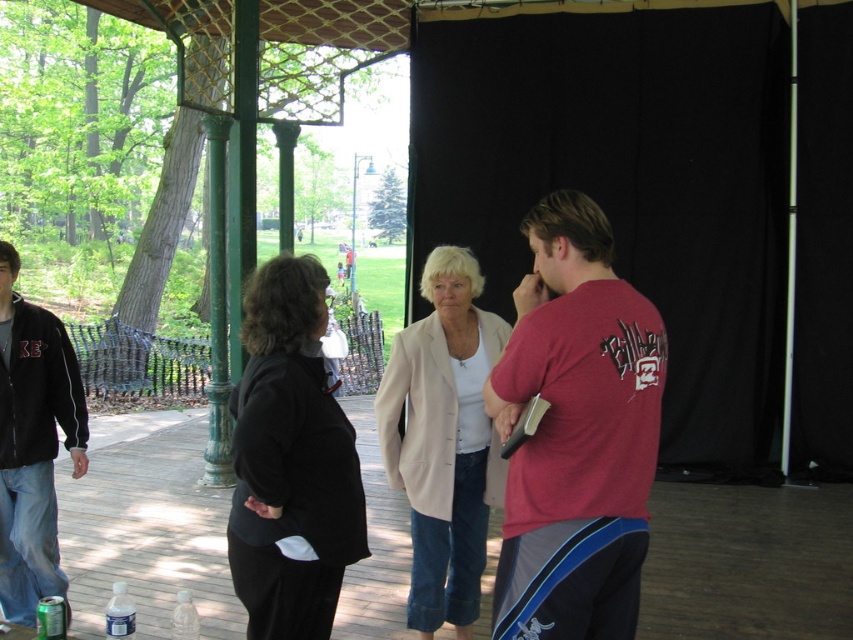
Question: Which of the following is the farthest from the observer?

Choices:
 (A) (416, 595)
 (B) (601, 632)
 (C) (22, 492)

Answer: (C)

Question: From the image, what is the correct spatial relationship of matte red t-shirt at right in relation to light beige fabric jacket at center?

Choices:
 (A) above
 (B) below

Answer: (A)

Question: Which point is farther from the camera taking this photo?

Choices:
 (A) (448, 432)
 (B) (614, 358)

Answer: (A)

Question: Among these points, which one is nearest to the camera?

Choices:
 (A) (1, 547)
 (B) (463, 358)
 (C) (628, 381)

Answer: (C)

Question: From the image, what is the correct spatial relationship of matte red t-shirt at right in relation to black fleece jacket at left?

Choices:
 (A) above
 (B) below

Answer: (A)

Question: Is matte red t-shirt at right positioned in front of black fleece jacket at left?

Choices:
 (A) no
 (B) yes

Answer: (B)